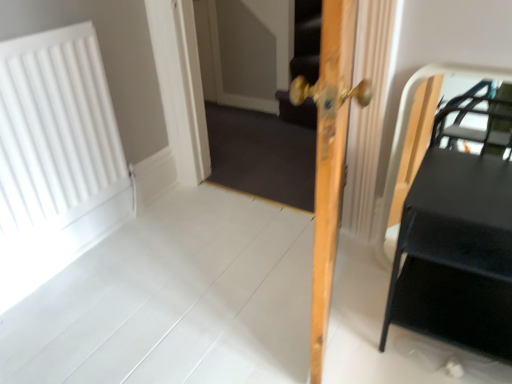
What are the coordinates of `free area in between white matte radiator at left and light wood door at center` in the screenshot? It's located at (190, 278).